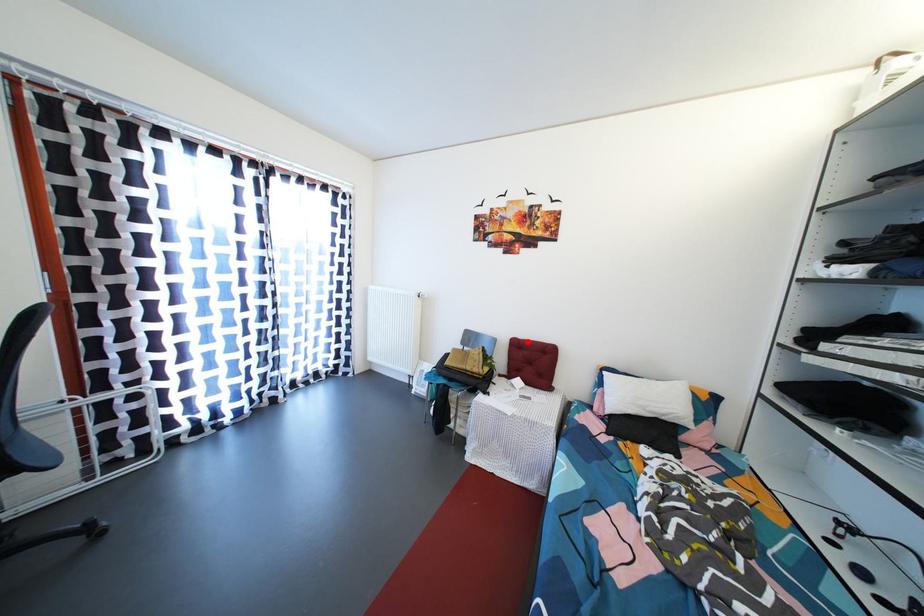
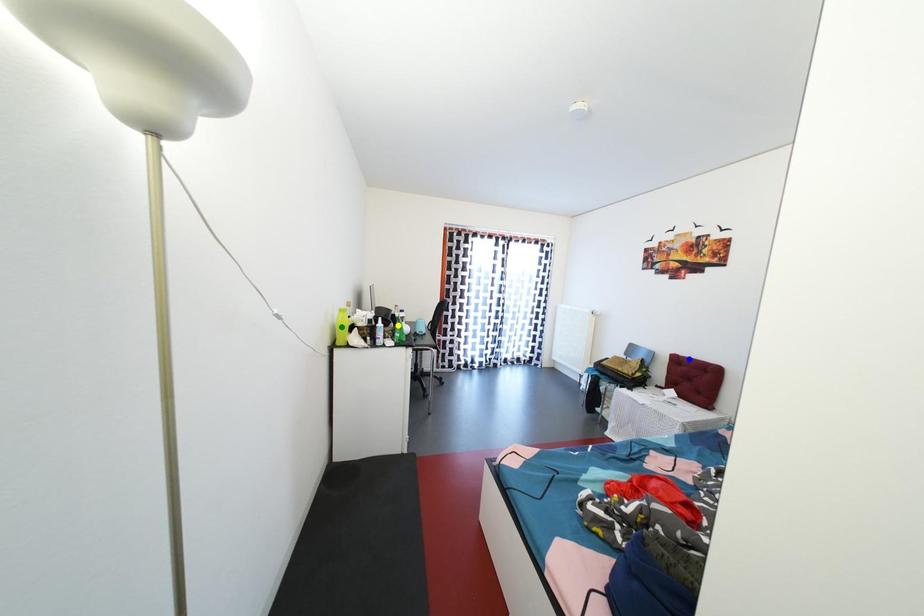
Question: I am providing you with two images of the same scene from different viewpoints. A red point is marked on the first image. You are given multiple points on the second image. Which spot in image 2 lines up with the point in image 1?

Choices:
 (A) green point
 (B) yellow point
 (C) blue point

Answer: (C)